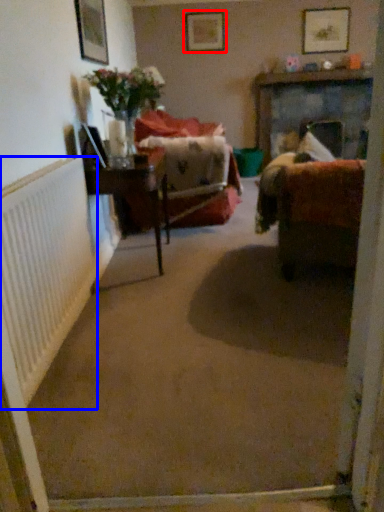
Question: Which object is further to the camera taking this photo, picture frame (highlighted by a red box) or radiator (highlighted by a blue box)?

Choices:
 (A) picture frame
 (B) radiator

Answer: (A)